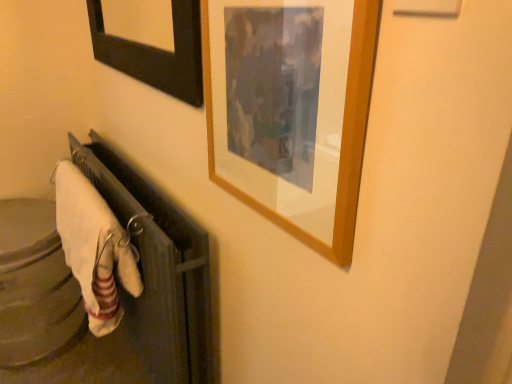
Describe the element at coordinates (94, 248) in the screenshot. I see `white soft towel at lower left` at that location.

From the picture: Measure the distance between point (117, 245) and camera.

A distance of 3.57 feet exists between point (117, 245) and camera.

Where is `white soft towel at lower left`? The height and width of the screenshot is (384, 512). white soft towel at lower left is located at coordinates (94, 248).

You are a GUI agent. You are given a task and a screenshot of the screen. Output one action in this format:
    pyautogui.click(x=<x>, y=<y>)
    Task: Click on the wooden picture frame at upper right
    
    Given the screenshot: What is the action you would take?
    pyautogui.click(x=342, y=138)

Image resolution: width=512 pixels, height=384 pixels. What do you see at coordinates (342, 138) in the screenshot?
I see `wooden picture frame at upper right` at bounding box center [342, 138].

The height and width of the screenshot is (384, 512). Identify the location of white soft towel at lower left. (94, 248).

Between wooden picture frame at upper right and white soft towel at lower left, which one appears on the left side from the viewer's perspective?

white soft towel at lower left.

Is wooden picture frame at upper right closer to the viewer compared to white soft towel at lower left?

Yes, wooden picture frame at upper right is in front of white soft towel at lower left.

Is point (289, 221) positioned after point (88, 197)?

No.

From the image's perspective, is wooden picture frame at upper right on white soft towel at lower left?

Correct, wooden picture frame at upper right appears higher than white soft towel at lower left in the image.

From a real-world perspective, between wooden picture frame at upper right and white soft towel at lower left, who is vertically higher?

From a 3D spatial view, wooden picture frame at upper right is above.

Considering the sizes of objects wooden picture frame at upper right and white soft towel at lower left in the image provided, who is thinner, wooden picture frame at upper right or white soft towel at lower left?

With smaller width is wooden picture frame at upper right.

Considering the relative sizes of wooden picture frame at upper right and white soft towel at lower left in the image provided, is wooden picture frame at upper right shorter than white soft towel at lower left?

Indeed, wooden picture frame at upper right has a lesser height compared to white soft towel at lower left.

From the picture: Can you confirm if wooden picture frame at upper right is bigger than white soft towel at lower left?

No, wooden picture frame at upper right is not bigger than white soft towel at lower left.

Based on the photo, is wooden picture frame at upper right not inside white soft towel at lower left?

wooden picture frame at upper right is positioned outside white soft towel at lower left.

Is wooden picture frame at upper right far away from white soft towel at lower left?

They are positioned close to each other.

Is wooden picture frame at upper right oriented towards white soft towel at lower left?

No, wooden picture frame at upper right does not turn towards white soft towel at lower left.

You are a GUI agent. You are given a task and a screenshot of the screen. Output one action in this format:
    pyautogui.click(x=<x>, y=<y>)
    Task: Click on the bath towel lying below the wooden picture frame at upper right (from the image's perspective)
    The width and height of the screenshot is (512, 384).
    Given the screenshot: What is the action you would take?
    pyautogui.click(x=94, y=248)

Can you confirm if white soft towel at lower left is positioned to the left of wooden picture frame at upper right?

Yes, white soft towel at lower left is to the left of wooden picture frame at upper right.

Does white soft towel at lower left lie behind wooden picture frame at upper right?

Yes, white soft towel at lower left is further from the camera.

Which is in front, point (128, 260) or point (355, 164)?

Point (355, 164)

From the image's perspective, does white soft towel at lower left appear higher than wooden picture frame at upper right?

No, from the image's perspective, white soft towel at lower left is not over wooden picture frame at upper right.

From a real-world perspective, is white soft towel at lower left above or below wooden picture frame at upper right?

white soft towel at lower left is situated lower than wooden picture frame at upper right in the real world.

Does white soft towel at lower left have a greater width compared to wooden picture frame at upper right?

Correct, the width of white soft towel at lower left exceeds that of wooden picture frame at upper right.

Who is shorter, white soft towel at lower left or wooden picture frame at upper right?

Standing shorter between the two is wooden picture frame at upper right.

In terms of size, does white soft towel at lower left appear bigger or smaller than wooden picture frame at upper right?

Clearly, white soft towel at lower left is larger in size than wooden picture frame at upper right.

Is white soft towel at lower left located outside wooden picture frame at upper right?

Yes, white soft towel at lower left is located beyond the bounds of wooden picture frame at upper right.

In the scene shown: Is the surface of white soft towel at lower left in direct contact with wooden picture frame at upper right?

No, white soft towel at lower left is not touching wooden picture frame at upper right.

Looking at this image, could you tell me if white soft towel at lower left is facing wooden picture frame at upper right?

No, white soft towel at lower left is not facing towards wooden picture frame at upper right.

In the scene shown: How many degrees apart are the facing directions of white soft towel at lower left and wooden picture frame at upper right?

1.1 degrees.

How much distance is there between white soft towel at lower left and wooden picture frame at upper right?

white soft towel at lower left and wooden picture frame at upper right are 22.41 inches apart.

Find the location of a particular element. The height and width of the screenshot is (384, 512). picture frame located above the white soft towel at lower left (from the image's perspective) is located at coordinates (342, 138).

I want to click on picture frame in front of the white soft towel at lower left, so [x=342, y=138].

Identify the location of picture frame above the white soft towel at lower left (from the image's perspective). This screenshot has width=512, height=384. (342, 138).